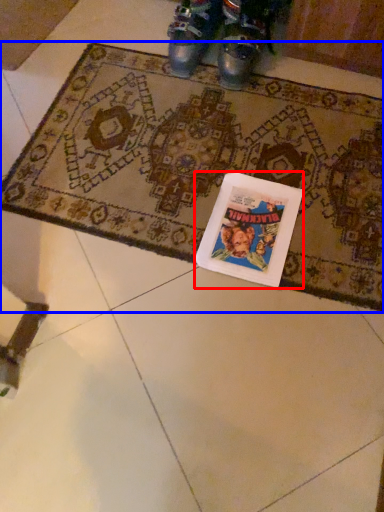
Question: Which point is further to the camera, book cover (highlighted by a red box) or mat (highlighted by a blue box)?

Choices:
 (A) book cover
 (B) mat

Answer: (A)